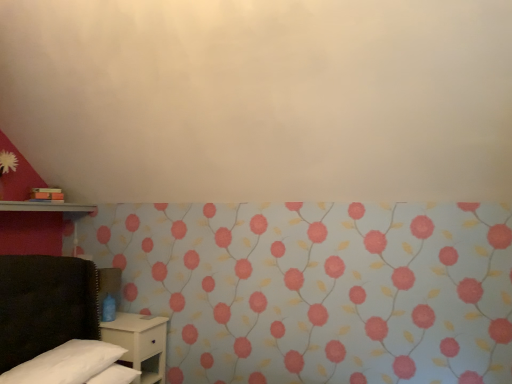
Question: In terms of width, does white matte nightstand at lower left look wider or thinner when compared to white soft pillow at lower left?

Choices:
 (A) thin
 (B) wide

Answer: (B)

Question: Visually, is white matte nightstand at lower left positioned to the left or to the right of white soft pillow at lower left?

Choices:
 (A) left
 (B) right

Answer: (B)

Question: Based on their relative distances, which object is farther from the metallic silver shelf at left?

Choices:
 (A) floral wallpaper at lower left
 (B) white soft pillow at lower left
 (C) white matte nightstand at lower left

Answer: (A)

Question: Estimate the real-world distances between objects in this image. Which object is farther from the metallic silver shelf at left?

Choices:
 (A) white matte nightstand at lower left
 (B) white soft pillow at lower left
 (C) floral wallpaper at lower left

Answer: (C)